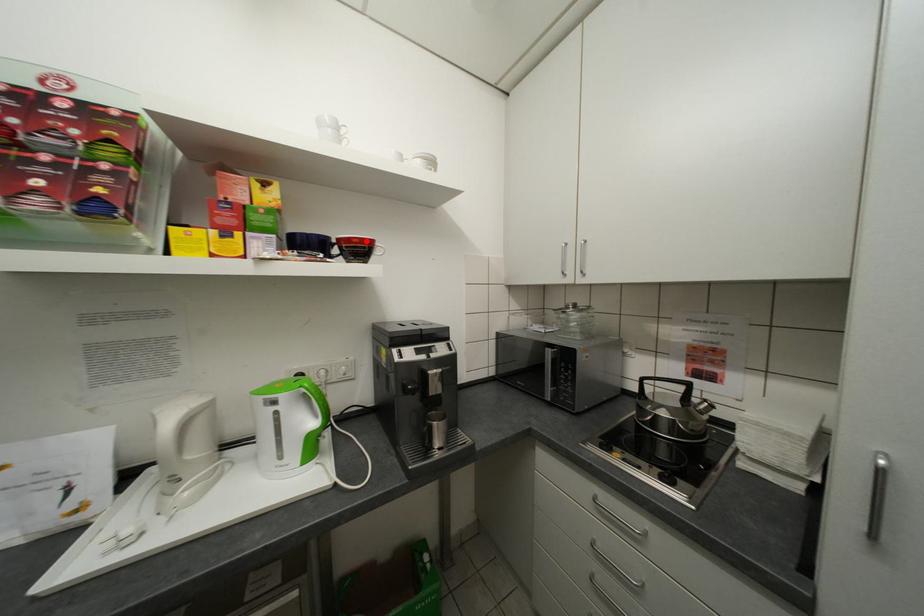
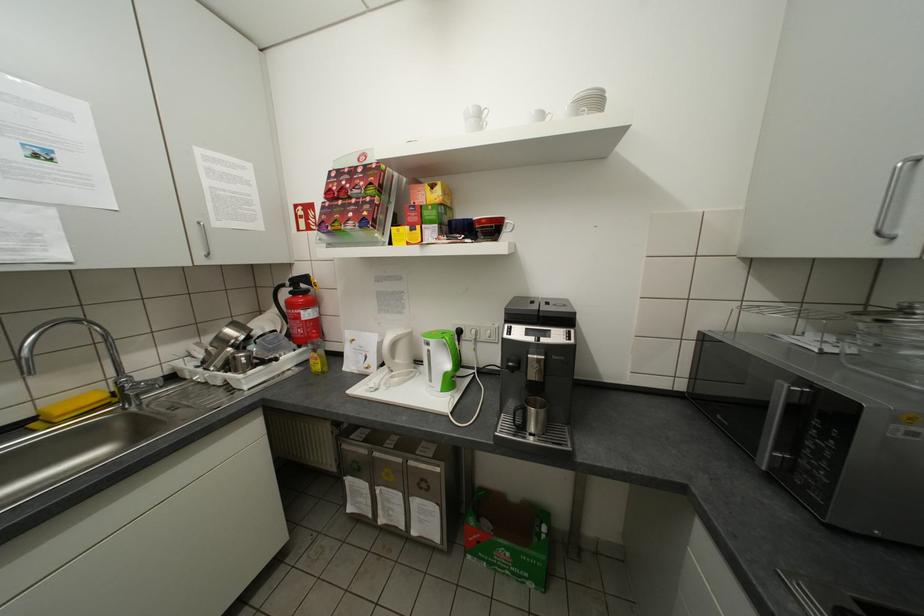
Question: I am providing you with two images of the same scene from different viewpoints. A red point is marked on the first image. Can you still see the location of the red point in image 2?

Choices:
 (A) Yes
 (B) No

Answer: (A)